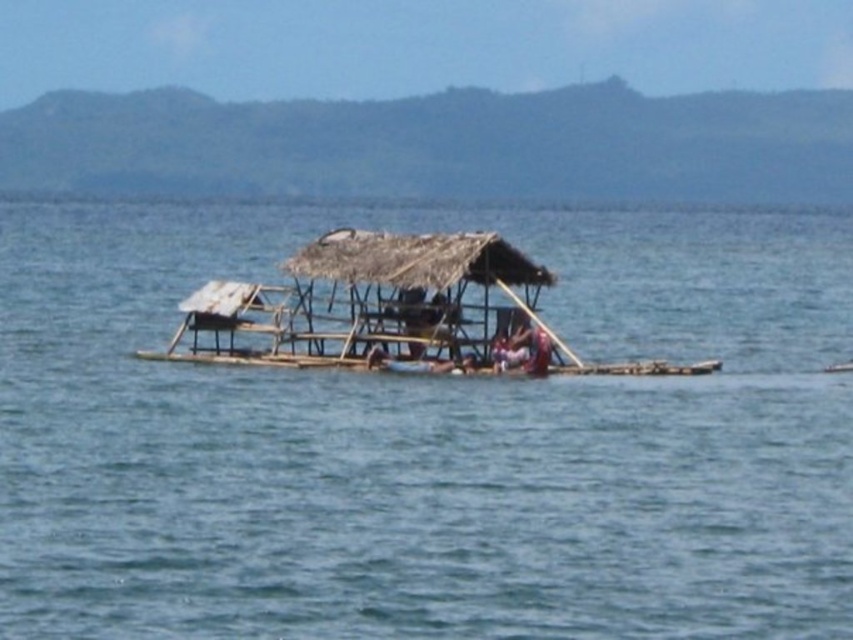
You are standing on the bamboo raft at center and want to look at the clear blue water at center. In which direction should you turn your head?

The clear blue water at center is positioned on the right side of bamboo raft at center, so you should turn your head to the right to look at the clear blue water at center.

You are standing on the point at coordinates (804,296) and want to reach the other side of the water. The distance between you and the nearest point on the opposite shore is 55.87 meters. If your boat can travel at 2 meters per second, how long will it take to reach the shore?

The distance between the point at coordinates (804,296) and the nearest point on the opposite shore is 55.87 meters. At a speed of 2 meters per second, it will take 55.87 divided by 2, which is approximately 27.94 seconds to reach the shore.